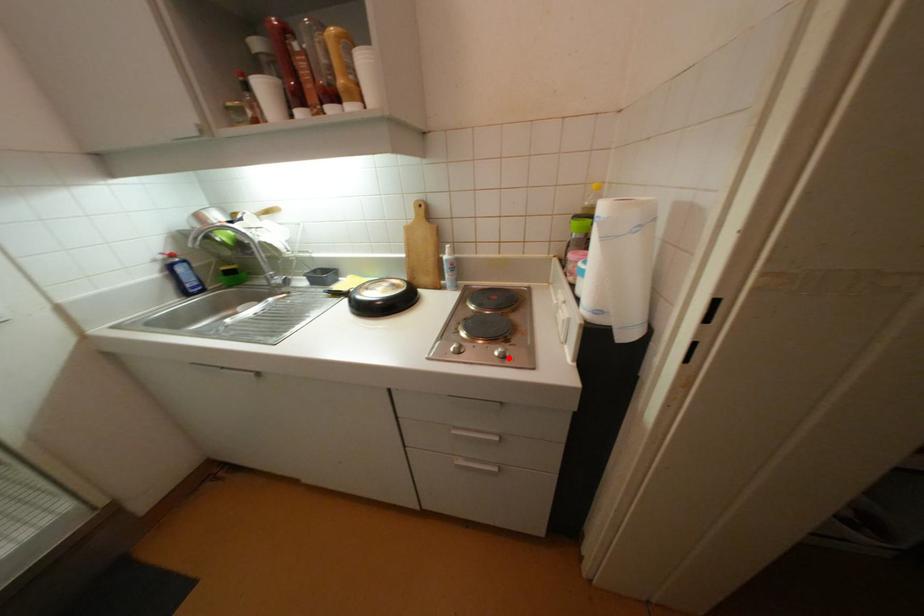
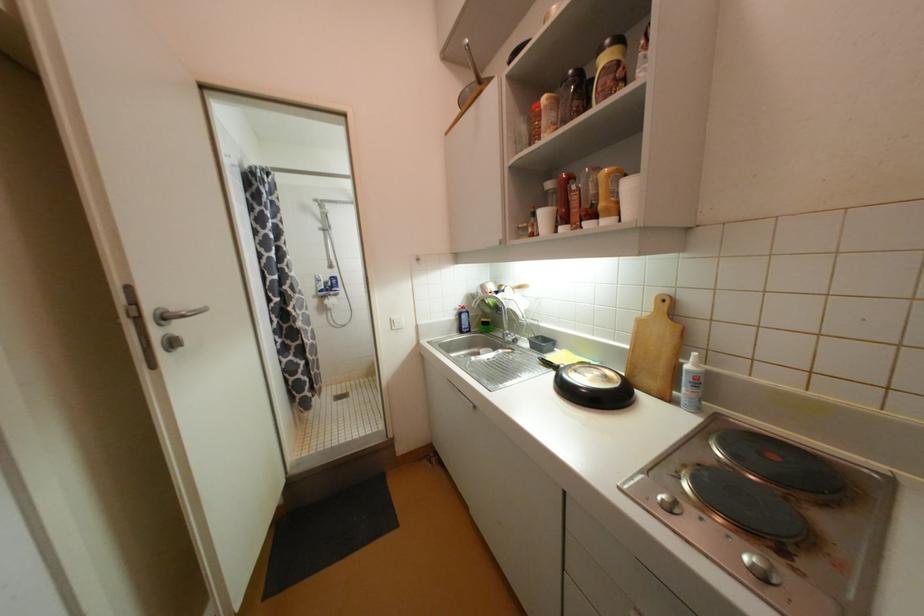
In the second image, find the point that corresponds to the highlighted location in the first image.

(768, 578)